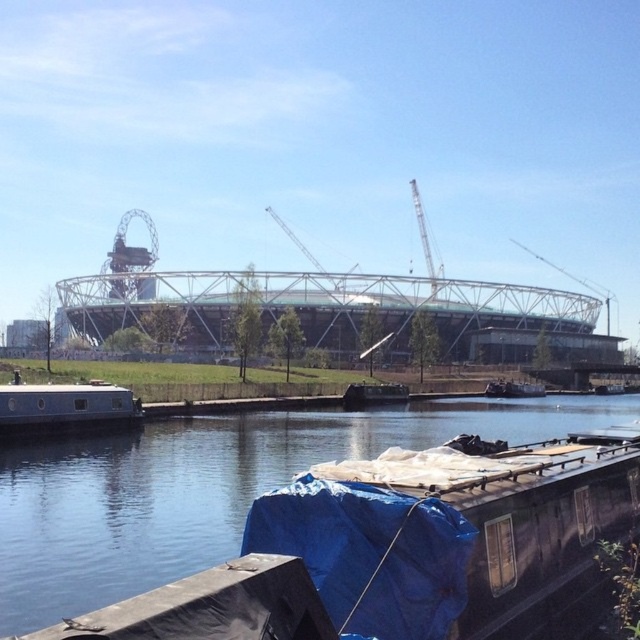
You are standing at the point with coordinates point (19,420) and want to walk to the point with coordinates point (573,406). Given that there is an obstacle between them, which direction should you move to reach your destination without going through the obstacle?

Since point (573,406) is behind point (19,420), you should move in a direction that goes around the obstacle behind point (19,420) to reach point (573,406).